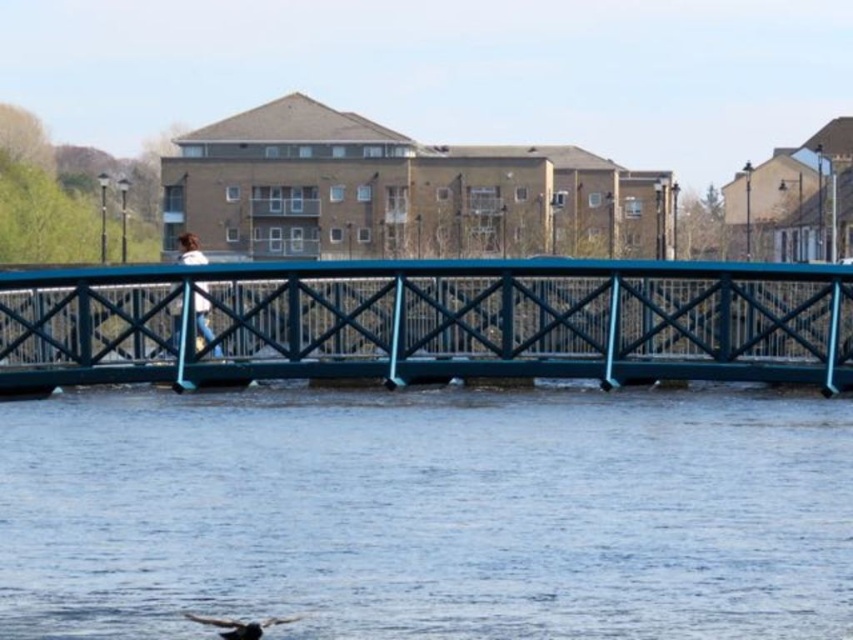
You are standing on the riverside and see the blue water at center and the white matte jacket at center. Which object is larger in size?

The white matte jacket at center is larger than the blue water at center.

You are a photographer trying to capture the entire view of the metallic blue pedestrian bridge at center and the white matte jacket at center in a single shot. Based on their sizes in the image, which object should you adjust your camera focus to ensure both are fully visible?

The metallic blue pedestrian bridge at center is smaller than the white matte jacket at center, so you should focus on the white matte jacket at center to ensure both are fully visible in the frame.

You are a photographer standing on the riverside bridge. You want to capture a photo of the blue water at center and the white matte jacket at center. Which object should you focus on first to ensure it appears sharp in the photo?

You should focus on the blue water at center first because it is in front of the white matte jacket at center. Since the jacket is behind the water, focusing on the closer object ensures it remains sharp while the background may blur slightly.